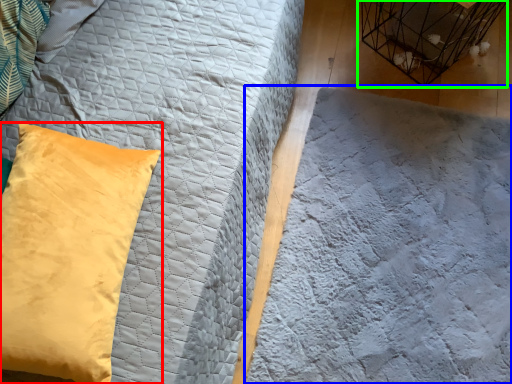
Question: Which object is positioned closest to pillow (highlighted by a red box)? Select from sheet (highlighted by a blue box) and bird cage (highlighted by a green box).

Choices:
 (A) sheet
 (B) bird cage

Answer: (A)